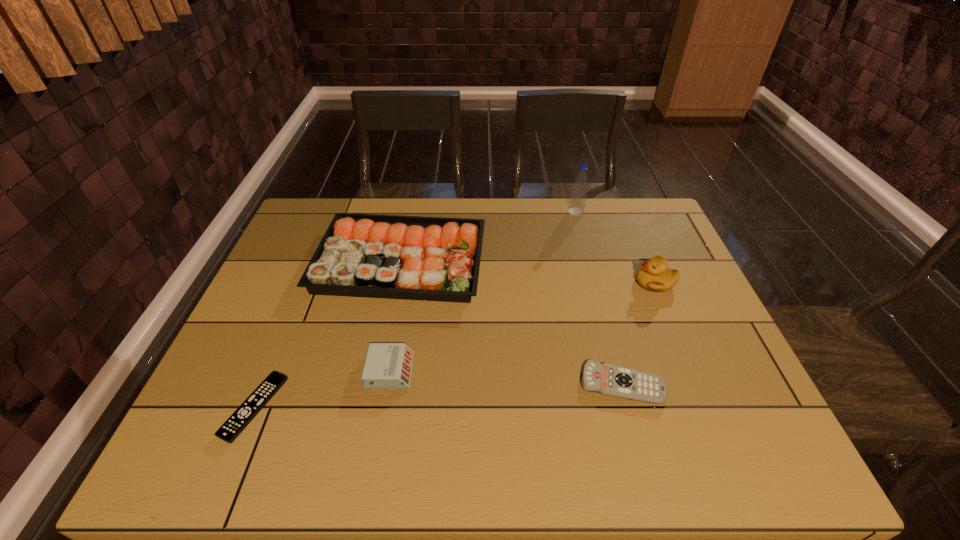
The height and width of the screenshot is (540, 960). What are the coordinates of `vacant space situated 0.370m on the front of the farthest object` in the screenshot? It's located at (599, 295).

This screenshot has width=960, height=540. I want to click on free space located 0.320m on the front-facing side of the fifth shortest object, so click(x=521, y=282).

I want to click on free location located 0.230m on the front-facing side of the fifth shortest object, so click(553, 282).

Locate an element on the screen. The width and height of the screenshot is (960, 540). vacant position located on the front-facing side of the fifth shortest object is located at coordinates (617, 282).

Where is `vacant space situated 0.100m on the front of the fourth shortest object`? The image size is (960, 540). vacant space situated 0.100m on the front of the fourth shortest object is located at coordinates (386, 336).

What are the coordinates of `vacant region located on the left of the third shortest object` in the screenshot? It's located at (311, 370).

Locate an element on the screen. vacant region located 0.240m on the left of the taller remote control is located at coordinates (474, 384).

At what (x,y) coordinates should I click in order to perform the action: click on vacant space situated 0.390m on the right of the left remote control. Please return your answer as a coordinate pair (x, y). This screenshot has width=960, height=540. Looking at the image, I should click on (460, 408).

Where is `water bottle that is positioned at the far edge`? The image size is (960, 540). water bottle that is positioned at the far edge is located at coordinates (579, 194).

Find the location of a particular element. This screenshot has width=960, height=540. platter located at the far edge is located at coordinates (360, 255).